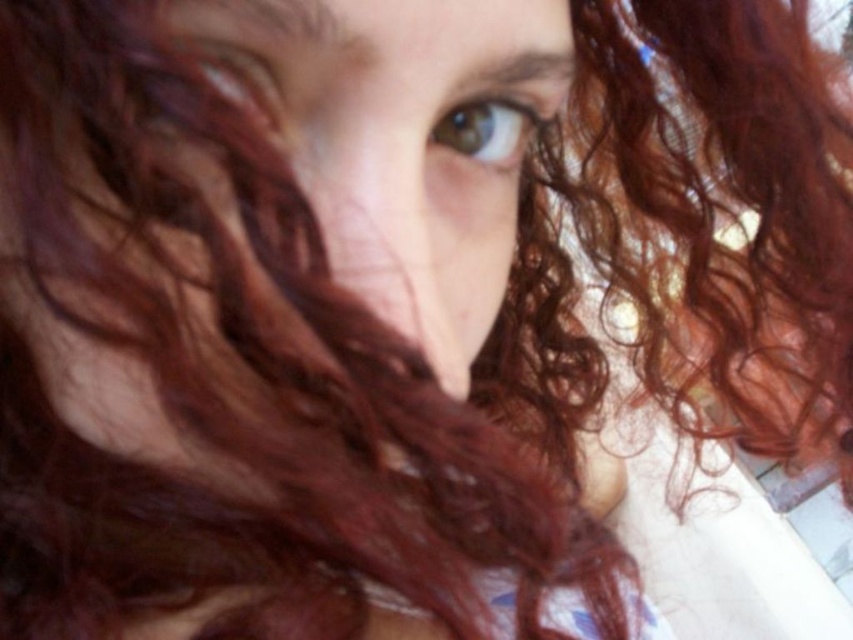
Question: Which point appears farthest from the camera in this image?

Choices:
 (A) (469, 156)
 (B) (508, 248)

Answer: (B)

Question: Does curly hair at center appear on the right side of brown matte eye at upper center?

Choices:
 (A) yes
 (B) no

Answer: (B)

Question: Which point is farther from the camera taking this photo?

Choices:
 (A) (538, 120)
 (B) (457, 138)

Answer: (A)

Question: Can you confirm if curly hair at center is positioned to the left of brown matte eye at upper center?

Choices:
 (A) no
 (B) yes

Answer: (B)

Question: Is the position of curly hair at center more distant than that of brown matte eye at upper center?

Choices:
 (A) no
 (B) yes

Answer: (A)

Question: Among these objects, which one is nearest to the camera?

Choices:
 (A) curly hair at center
 (B) brown matte eye at upper center

Answer: (A)